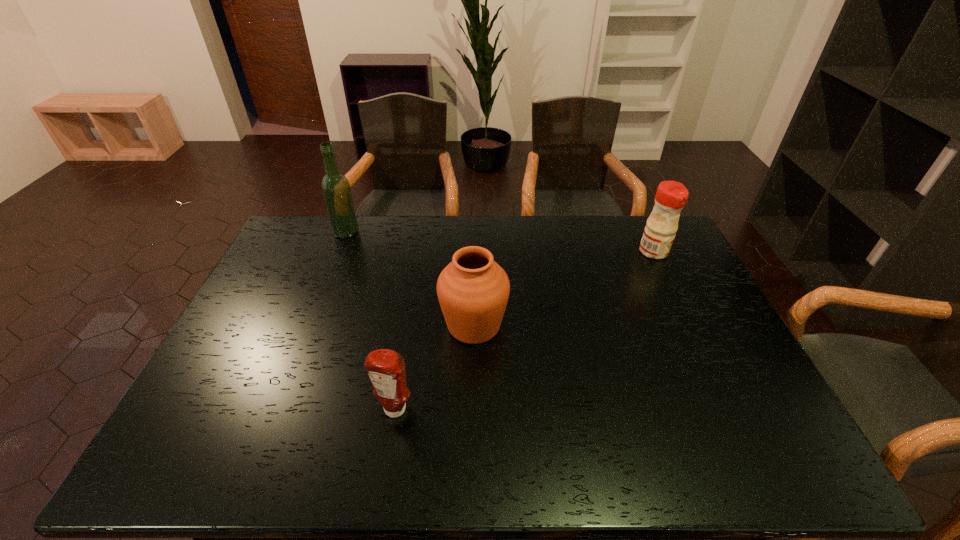
Select which object appears as the second closest to the shorter condiment. Please provide its 2D coordinates. Your answer should be formatted as a tuple, i.e. [(x, y)], where the tuple contains the x and y coordinates of a point satisfying the conditions above.

[(336, 189)]